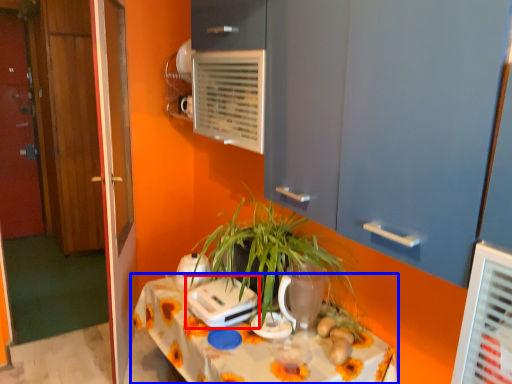
Question: Among these objects, which one is nearest to the camera, appliance (highlighted by a red box) or table (highlighted by a blue box)?

Choices:
 (A) appliance
 (B) table

Answer: (B)